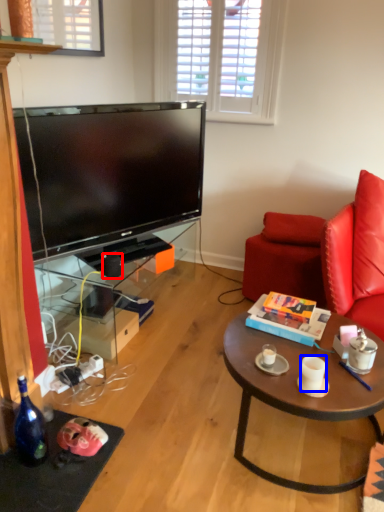
Question: Which point is further to the camera, speaker (highlighted by a red box) or coffee cup (highlighted by a blue box)?

Choices:
 (A) speaker
 (B) coffee cup

Answer: (A)